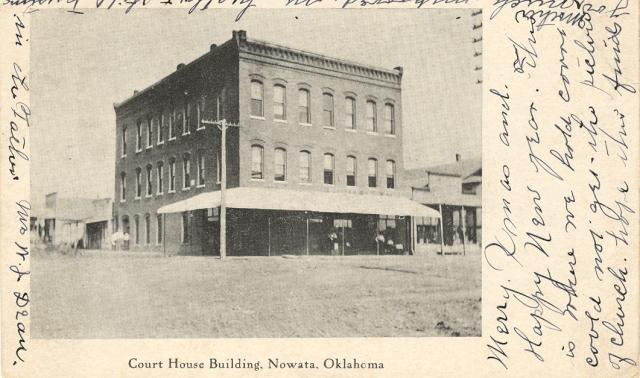
Where is `chimney`? This screenshot has height=378, width=640. chimney is located at coordinates (457, 155).